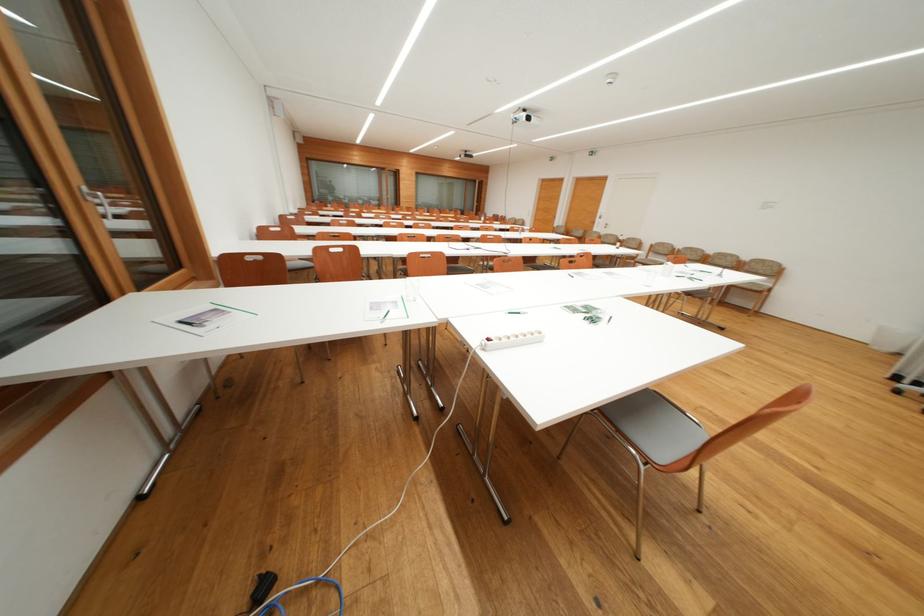
What are the coordinates of `silver door handle` in the screenshot? It's located at [x=614, y=214].